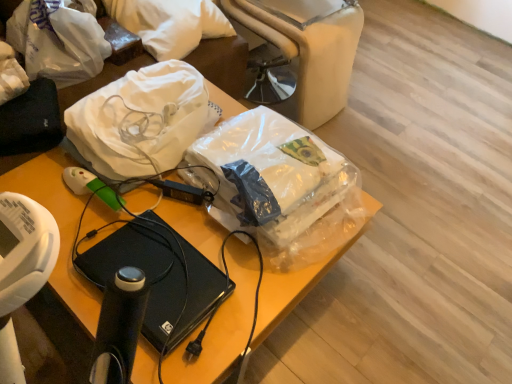
The image size is (512, 384). Find the location of `free spot above black plastic laptop at center (from a real-world perspective)`. free spot above black plastic laptop at center (from a real-world perspective) is located at coordinates (173, 226).